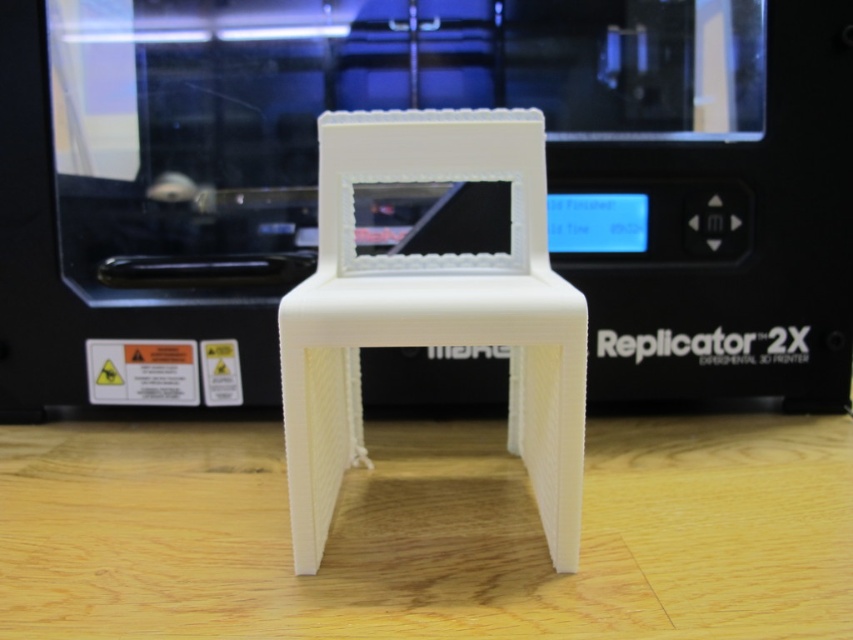
You are an engineer inspecting a 3D printed chair setup. You notice two objects labeled as white matte chair at center and white matte plastic chair at center in the scene. Which one is positioned lower in the image?

The white matte chair at center is positioned lower than the white matte plastic chair at center in the image.

You are an engineer inspecting a 3D printed chair and its printer. You notice two objects labeled as the white matte chair at center and the white matte plastic chair at center. Wait, but there seems to be a discrepancy in their labels. Can you clarify which one is the actual 3D printed chair and which is the printer? Based on their descriptions, which one is more likely to have visible layers and slight imperfections from the printing process?

The white matte chair at center is the actual 3D printed chair and has visible layers and slight imperfections from the printing process, while the white matte plastic chair at center refers to the MakerBot Replicator 2X 3D printer itself.